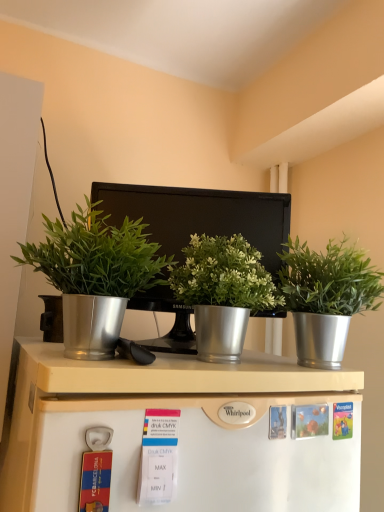
Question: In which direction should I rotate to look at metallic silver pot at center, which is the 2th houseplant from left to right?

Choices:
 (A) left
 (B) right

Answer: (B)

Question: From the image's perspective, would you say white matte refrigerator at lower center is positioned over metallic silver pot at center, which is the 2th houseplant from left to right?

Choices:
 (A) no
 (B) yes

Answer: (A)

Question: Is white matte refrigerator at lower center further to the viewer compared to metallic silver pot at center, which is the 2th houseplant from left to right?

Choices:
 (A) yes
 (B) no

Answer: (B)

Question: Is metallic silver pot at center, which is the 2th houseplant from left to right, at the back of white matte refrigerator at lower center?

Choices:
 (A) yes
 (B) no

Answer: (B)

Question: Can you see white matte refrigerator at lower center touching metallic silver pot at center, which is the 2th houseplant from left to right?

Choices:
 (A) yes
 (B) no

Answer: (B)

Question: Could you tell me if white matte refrigerator at lower center is turned towards metallic silver pot at center, which is the 2th houseplant from left to right?

Choices:
 (A) no
 (B) yes

Answer: (A)

Question: Considering the relative sizes of white matte refrigerator at lower center and metallic silver pot at center, which is the 2th houseplant from left to right, in the image provided, is white matte refrigerator at lower center taller than metallic silver pot at center, which is the 2th houseplant from left to right,?

Choices:
 (A) yes
 (B) no

Answer: (B)

Question: Does metallic silver pot at center, the second houseplant in the right-to-left sequence, lie in front of silver metallic plant pot at center, which is the 3th houseplant in left-to-right order?

Choices:
 (A) no
 (B) yes

Answer: (B)

Question: Is metallic silver pot at center, the second houseplant in the right-to-left sequence, aimed at silver metallic plant pot at center, which is the 3th houseplant in left-to-right order?

Choices:
 (A) yes
 (B) no

Answer: (B)

Question: Does metallic silver pot at center, the second houseplant in the right-to-left sequence, have a lesser height compared to silver metallic plant pot at center, positioned as the 1th houseplant in right-to-left order?

Choices:
 (A) no
 (B) yes

Answer: (B)

Question: Is there a large distance between metallic silver pot at center, the second houseplant in the right-to-left sequence, and silver metallic plant pot at center, positioned as the 1th houseplant in right-to-left order?

Choices:
 (A) no
 (B) yes

Answer: (A)

Question: Can you confirm if metallic silver pot at center, which is the 2th houseplant from left to right, is positioned to the right of silver metallic plant pot at center, which is the 3th houseplant in left-to-right order?

Choices:
 (A) yes
 (B) no

Answer: (B)

Question: Is metallic silver pot at center, which is the 2th houseplant from left to right, wider than silver metallic plant pot at center, which is the 3th houseplant in left-to-right order?

Choices:
 (A) no
 (B) yes

Answer: (A)

Question: Considering the relative sizes of metallic silver monitor at center and metallic silver plant pot at left, positioned as the 1th houseplant in left-to-right order, in the image provided, is metallic silver monitor at center wider than metallic silver plant pot at left, positioned as the 1th houseplant in left-to-right order,?

Choices:
 (A) yes
 (B) no

Answer: (B)